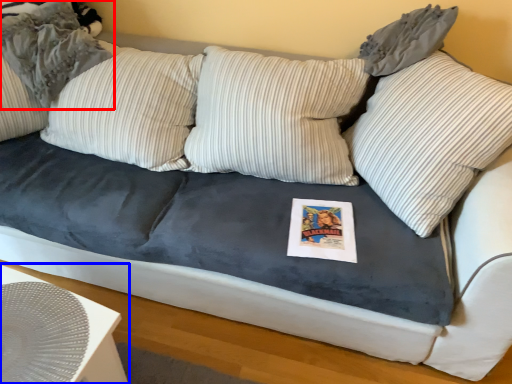
Question: Among these objects, which one is farthest to the camera, pillow (highlighted by a red box) or table (highlighted by a blue box)?

Choices:
 (A) pillow
 (B) table

Answer: (A)